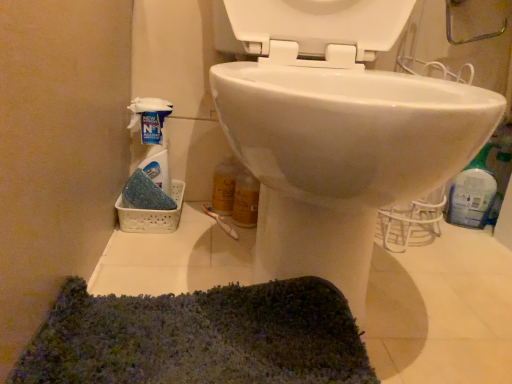
Question: Is white glossy toilet at center to the left or to the right of white plastic spray bottle at left, which is the second cleaning product in right-to-left order, in the image?

Choices:
 (A) right
 (B) left

Answer: (A)

Question: From their relative heights in the image, would you say white glossy toilet at center is taller or shorter than white plastic spray bottle at left, the first cleaning product positioned from the left?

Choices:
 (A) short
 (B) tall

Answer: (B)

Question: Which is farther from the white glossy toilet at center?

Choices:
 (A) blue plastic bottle at right, which is counted as the 1th cleaning product, starting from the right
 (B) white plastic spray bottle at left, the first cleaning product positioned from the left

Answer: (A)

Question: Considering the real-world distances, which object is farthest from the white plastic spray bottle at left, the first cleaning product positioned from the left?

Choices:
 (A) blue plastic bottle at right, which is counted as the 1th cleaning product, starting from the right
 (B) white glossy toilet at center

Answer: (A)